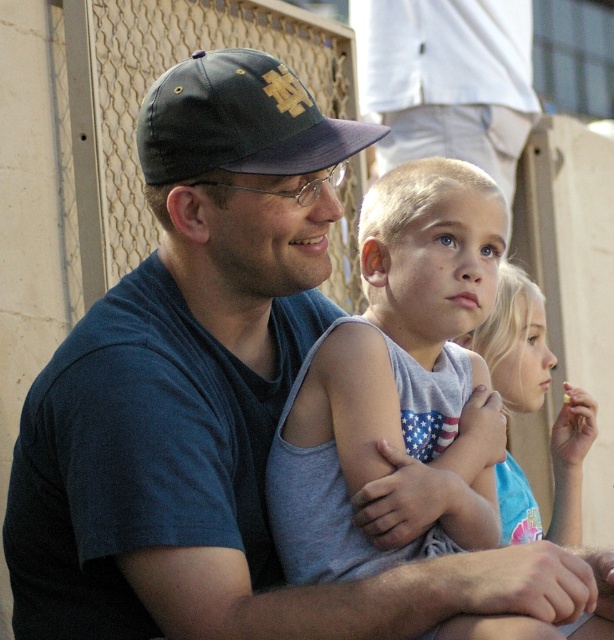
You are designing a layout for a magazine cover and need to place the dark blue fabric baseball cap at upper left and the light blue tank top at center. Considering their sizes, which object should be placed closer to the edge of the page to maintain visual balance?

The dark blue fabric baseball cap at upper left should be placed closer to the edge of the page because it occupies less space than the light blue tank top at center, helping to balance the visual weight between the two elements.

You are a photographer standing at the edge of the scene. You want to take a photo of the dark blue fabric baseball cap at upper left and the light blue tank top at center. Can you fit both subjects into your camera frame if your camera has a maximum horizontal field of view of 2 meters?

The distance between the dark blue fabric baseball cap at upper left and the light blue tank top at center is 2.69 meters, which exceeds the camera frame of 2 meters. Therefore, both subjects cannot be captured in a single frame.

You are designing a storage box that needs to fit both the dark blue fabric baseball cap at upper left and the light blue tank top at center. Based on their widths, which item should be placed first in the box to ensure both fit properly?

The dark blue fabric baseball cap at upper left might be wider than the light blue tank top at center, so it should be placed first in the box to accommodate its width before adding the tank top.